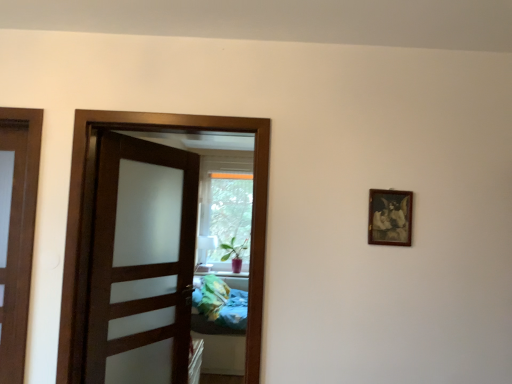
Question: Is green matte plant at center aimed at brown wooden door at center?

Choices:
 (A) yes
 (B) no

Answer: (B)

Question: Is green matte plant at center wider than brown wooden door at center?

Choices:
 (A) yes
 (B) no

Answer: (A)

Question: From a real-world perspective, is green matte plant at center positioned under brown wooden door at center based on gravity?

Choices:
 (A) yes
 (B) no

Answer: (A)

Question: Does green matte plant at center come behind brown wooden door at center?

Choices:
 (A) no
 (B) yes

Answer: (B)

Question: Is green matte plant at center placed right next to brown wooden door at center?

Choices:
 (A) yes
 (B) no

Answer: (B)

Question: Is green matte plant at center at the right side of brown wooden door at center?

Choices:
 (A) yes
 (B) no

Answer: (A)

Question: Would you say brown wooden door at center is outside wooden picture frame at upper right?

Choices:
 (A) no
 (B) yes

Answer: (B)

Question: Considering the relative positions of brown wooden door at center and wooden picture frame at upper right in the image provided, is brown wooden door at center behind wooden picture frame at upper right?

Choices:
 (A) yes
 (B) no

Answer: (B)

Question: Is brown wooden door at center turned away from wooden picture frame at upper right?

Choices:
 (A) yes
 (B) no

Answer: (B)

Question: Could you tell me if brown wooden door at center is facing wooden picture frame at upper right?

Choices:
 (A) no
 (B) yes

Answer: (A)

Question: Is the position of brown wooden door at center less distant than that of wooden picture frame at upper right?

Choices:
 (A) yes
 (B) no

Answer: (A)

Question: From the image's perspective, is brown wooden door at center located beneath wooden picture frame at upper right?

Choices:
 (A) no
 (B) yes

Answer: (B)

Question: From the image's perspective, is green matte plant at center beneath wooden picture frame at upper right?

Choices:
 (A) yes
 (B) no

Answer: (A)